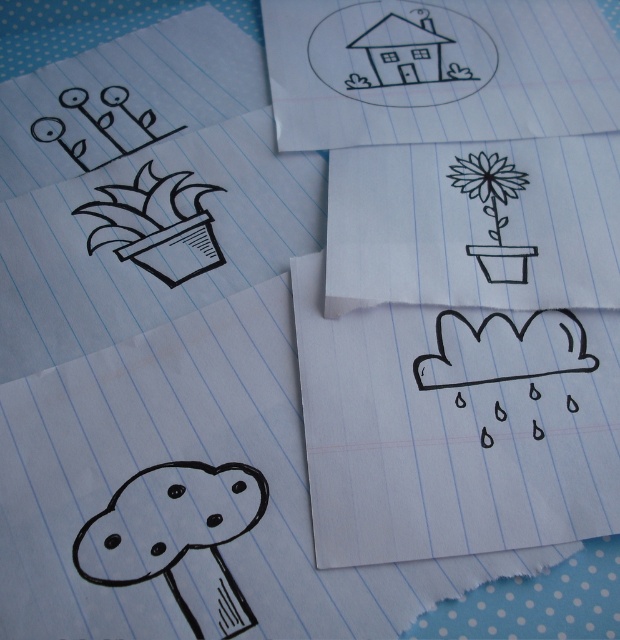
Question: Which object is positioned closest to the black line cloud at center?

Choices:
 (A) black line drawing flower at center
 (B) black line drawing flower pot at center
 (C) black line drawing house at upper center

Answer: (B)

Question: Which object is the closest to the black line drawing house at upper center?

Choices:
 (A) black line drawing flower at center
 (B) black line drawing flower pot at center
 (C) black line cloud at center

Answer: (B)

Question: Which of the following is the closest to the observer?

Choices:
 (A) black line drawing flower at center
 (B) black line cloud at center

Answer: (B)

Question: Is black line cloud at center to the right of black line drawing flower pot at center from the viewer's perspective?

Choices:
 (A) yes
 (B) no

Answer: (B)

Question: Observing the image, what is the correct spatial positioning of black line cloud at center in reference to black line drawing house at upper center?

Choices:
 (A) left
 (B) right

Answer: (A)

Question: Can you confirm if black line drawing house at upper center is positioned above black line drawing flower at center?

Choices:
 (A) yes
 (B) no

Answer: (A)